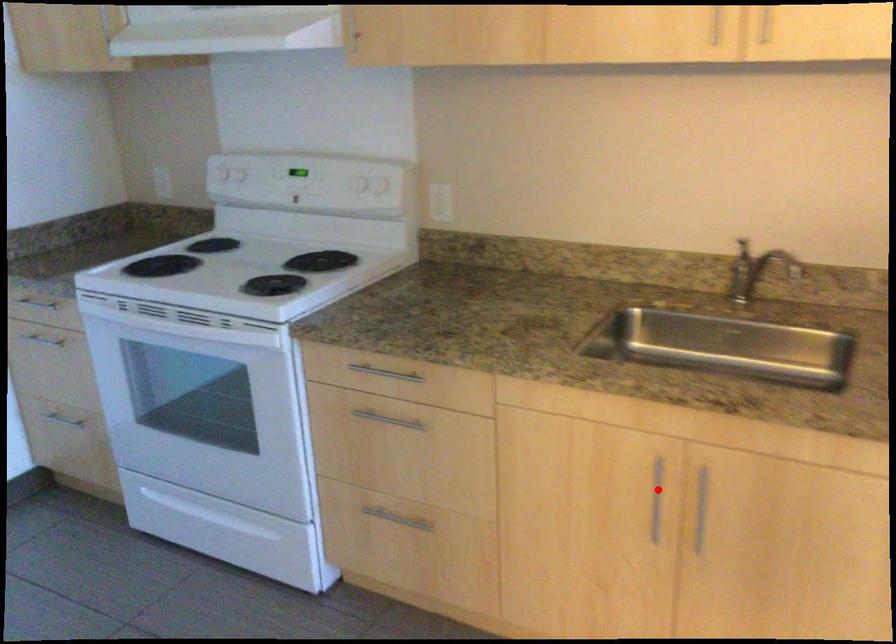
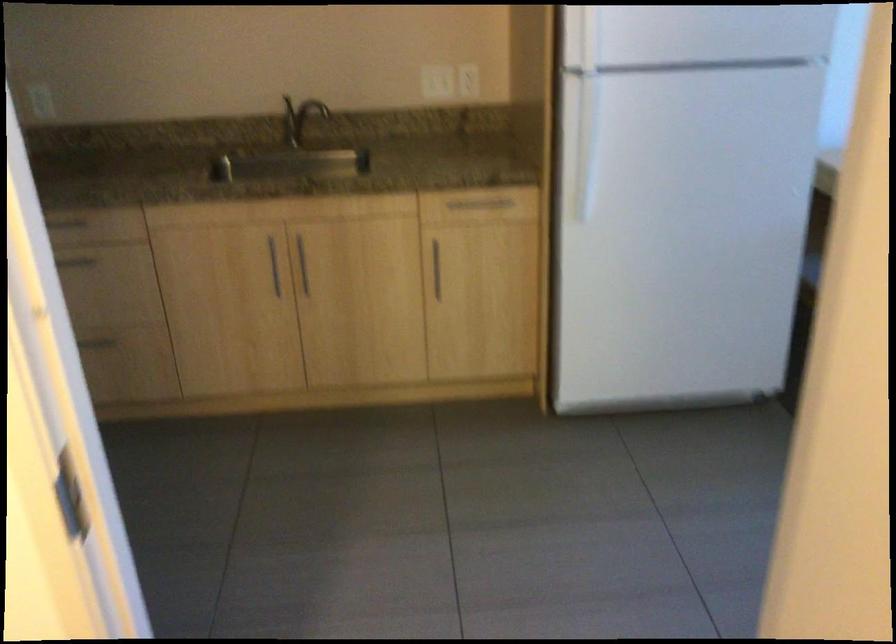
Question: I am providing you with two images of the same scene from different viewpoints. A red point is shown in image1. For the corresponding object point in image2, is it positioned nearer or farther from the camera?

Choices:
 (A) Nearer
 (B) Farther

Answer: (B)